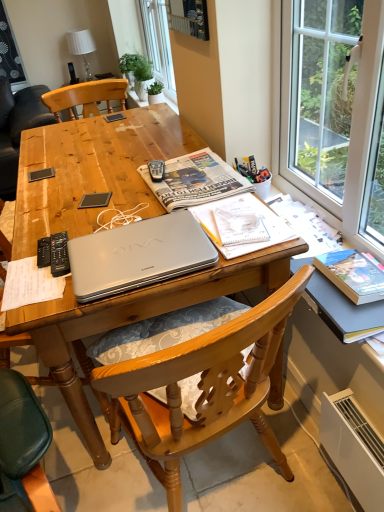
Where is `vacant area that lies between silver metallic laptop at center and black plastic remote control at left, which is counted as the first remote control, starting from the right`? vacant area that lies between silver metallic laptop at center and black plastic remote control at left, which is counted as the first remote control, starting from the right is located at coordinates (84, 237).